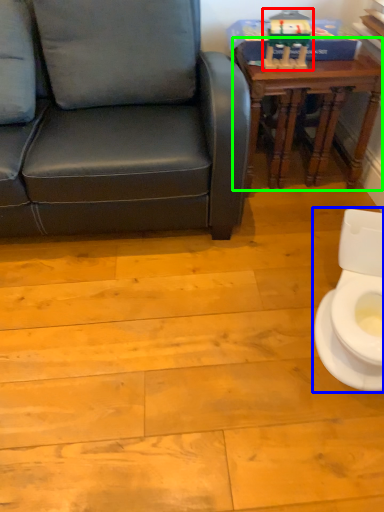
Question: Which object is positioned closest to toy (highlighted by a red box)? Select from toilet (highlighted by a blue box) and table (highlighted by a green box).

Choices:
 (A) toilet
 (B) table

Answer: (B)